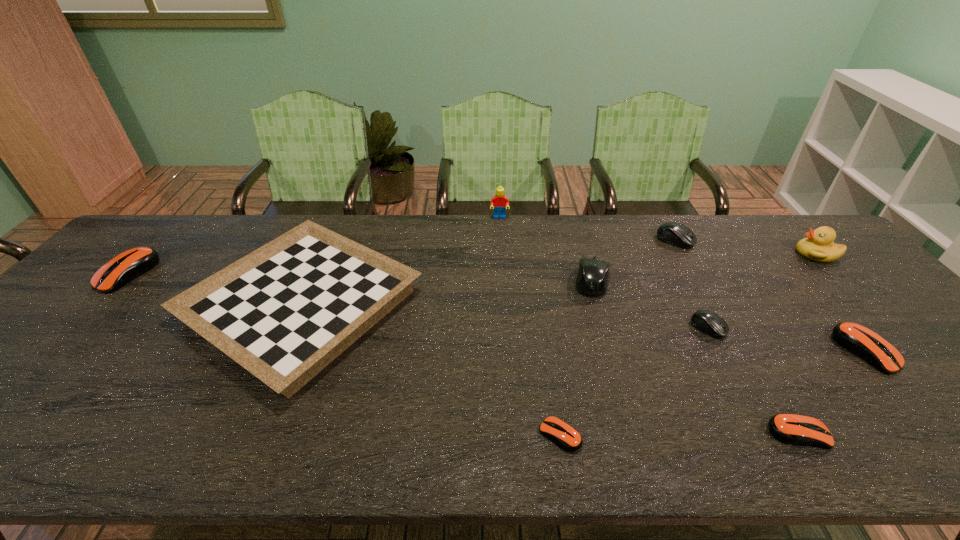
I want to click on free point between the second object from left to right and the third biggest orange computer mouse, so click(x=551, y=370).

Where is `object identified as the fifth closest to the checkerboard`? Image resolution: width=960 pixels, height=540 pixels. object identified as the fifth closest to the checkerboard is located at coordinates (708, 322).

Identify which object is the second closest to the eighth object from right to left. Please provide its 2D coordinates. Your answer should be formatted as a tuple, i.e. [(x, y)], where the tuple contains the x and y coordinates of a point satisfying the conditions above.

[(592, 279)]

Identify the location of the fifth closest computer mouse to the second farthest black mouse. (859, 340).

This screenshot has height=540, width=960. I want to click on computer mouse identified as the fifth closest to the farthest computer mouse, so click(564, 435).

Locate an element on the screen. The height and width of the screenshot is (540, 960). the third closest black mouse to the third smallest orange computer mouse is located at coordinates (592, 279).

Identify which black mouse is the second nearest to the second tallest object. Please provide its 2D coordinates. Your answer should be formatted as a tuple, i.e. [(x, y)], where the tuple contains the x and y coordinates of a point satisfying the conditions above.

[(708, 322)]

I want to click on orange computer mouse identified as the closest to the ninth shortest object, so click(x=859, y=340).

Find the location of a particular element. orange computer mouse that is the closest to the rightmost computer mouse is located at coordinates (793, 429).

What are the coordinates of `vacant space that satisfies the following two spatial constraints: 1. on the face of the second farthest orange computer mouse; 2. on the right side of the Lego` in the screenshot? It's located at (507, 350).